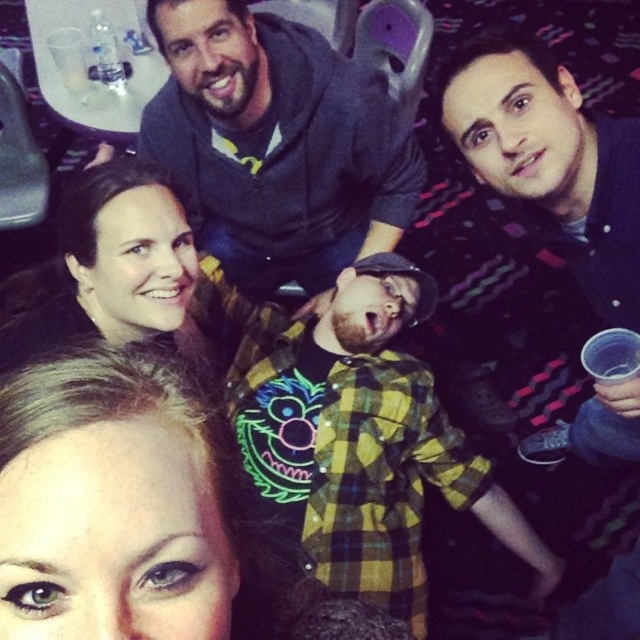
Question: Among these points, which one is farthest from the camera?

Choices:
 (A) (410, 397)
 (B) (19, 340)

Answer: (A)

Question: Which point is closer to the camera?

Choices:
 (A) (184, 170)
 (B) (12, 284)
 (C) (340, 493)

Answer: (C)

Question: Is yellow plaid shirt at center wider than matte gray hoodie at upper center?

Choices:
 (A) yes
 (B) no

Answer: (A)

Question: Can you confirm if matte gray hoodie at upper center is smaller than matte black hair at upper left?

Choices:
 (A) yes
 (B) no

Answer: (B)

Question: Which point is closer to the camera taking this photo?

Choices:
 (A) (356, 547)
 (B) (150, 104)
 (C) (192, 244)

Answer: (C)

Question: Is yellow plaid shirt at center closer to the viewer compared to matte gray hoodie at upper center?

Choices:
 (A) yes
 (B) no

Answer: (A)